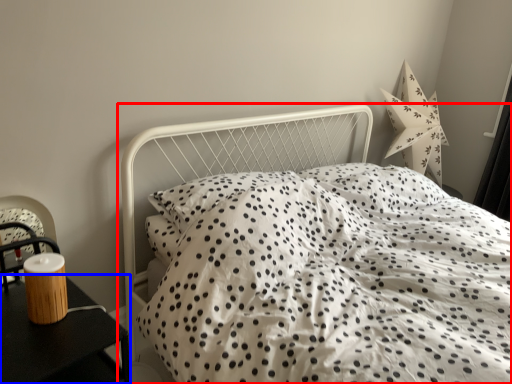
Question: Among these objects, which one is nearest to the camera, bed (highlighted by a red box) or nightstand (highlighted by a blue box)?

Choices:
 (A) bed
 (B) nightstand

Answer: (A)